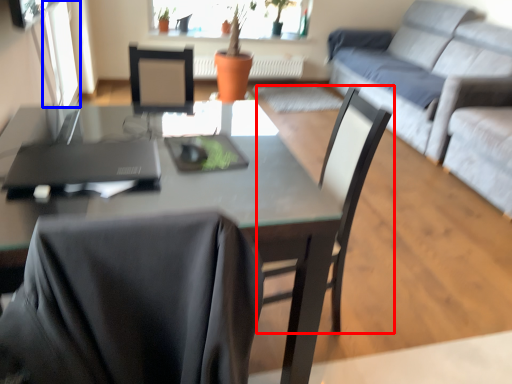
Question: Which of the following is the farthest to the observer, chair (highlighted by a red box) or window screen (highlighted by a blue box)?

Choices:
 (A) chair
 (B) window screen

Answer: (B)